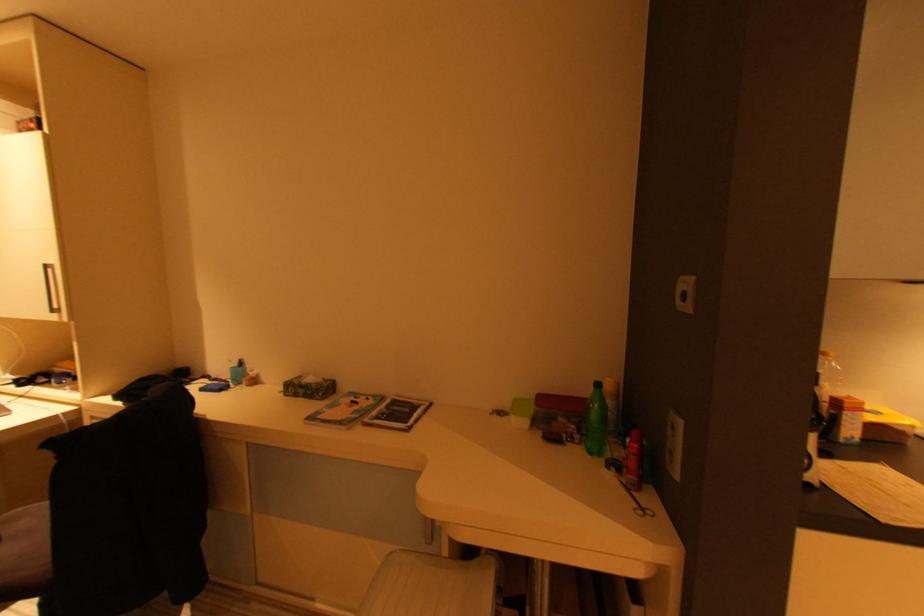
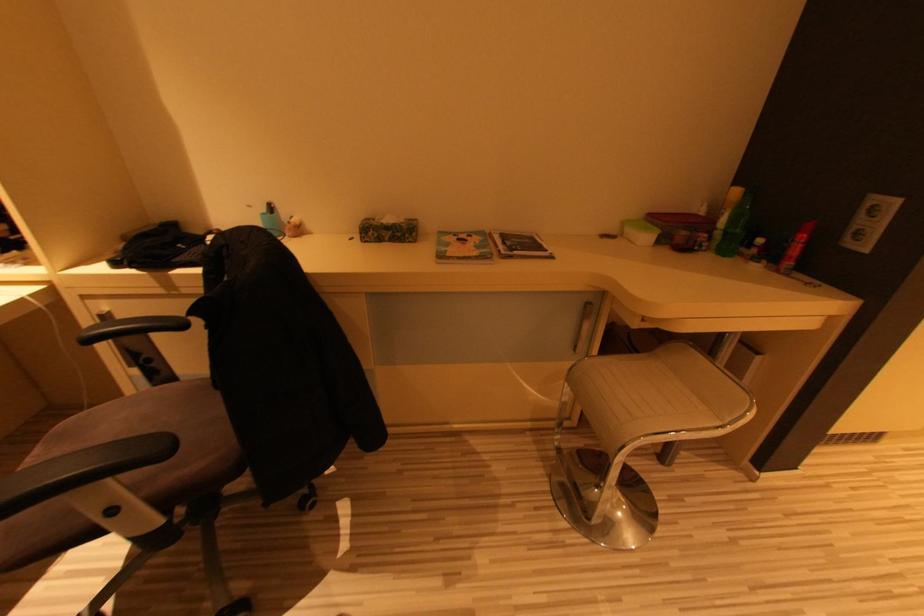
Question: The images are taken continuously from a first-person perspective. In which direction are you moving?

Choices:
 (A) Left
 (B) Right
 (C) Forward
 (D) Backward

Answer: (A)